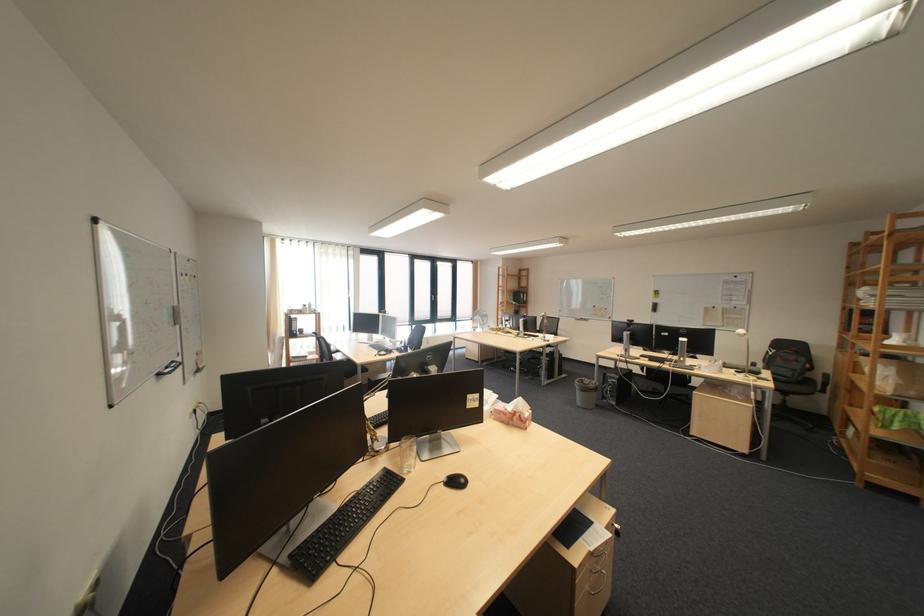
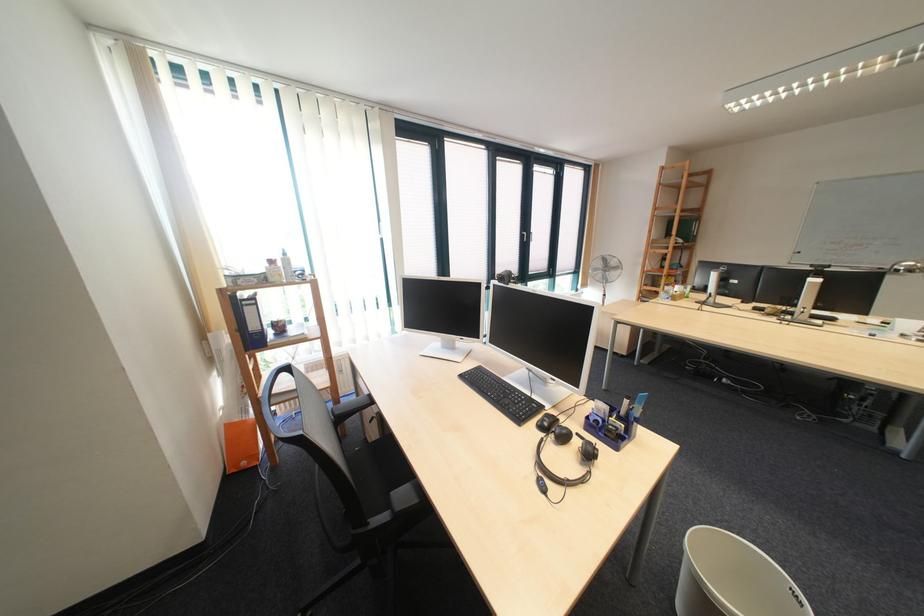
In a continuous first-person perspective shot, in which direction is the camera moving?

The cameraman moved toward left, forward.